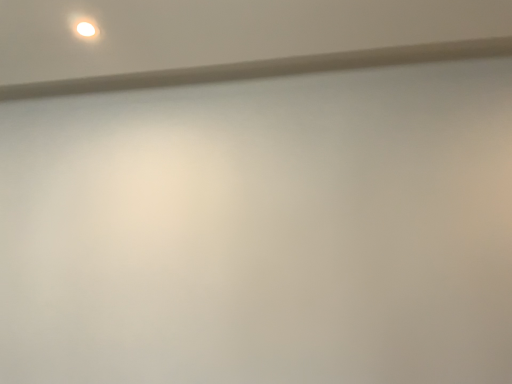
The image size is (512, 384). What are the coordinates of `white glossy light fixture at upper left` in the screenshot? It's located at (86, 28).

Describe the element at coordinates (86, 28) in the screenshot. I see `white glossy light fixture at upper left` at that location.

Where is `white glossy light fixture at upper left`? The width and height of the screenshot is (512, 384). white glossy light fixture at upper left is located at coordinates (86, 28).